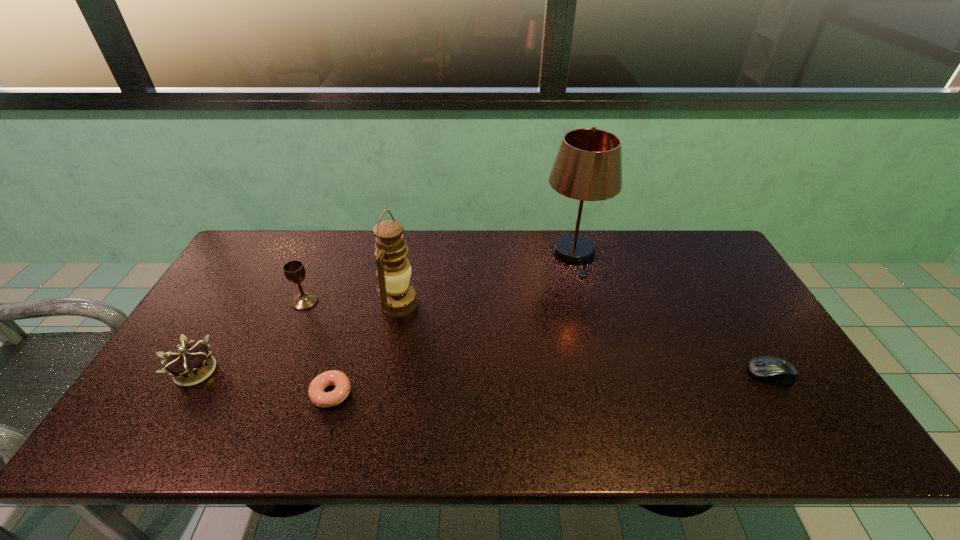
You are a GUI agent. You are given a task and a screenshot of the screen. Output one action in this format:
    pyautogui.click(x=<x>, y=<y>)
    Task: Click on the free point located on the front-facing side of the tallest object
    
    Given the screenshot: What is the action you would take?
    pyautogui.click(x=608, y=384)

Where is `vacant space situated 0.100m on the front of the oil lamp`? Image resolution: width=960 pixels, height=540 pixels. vacant space situated 0.100m on the front of the oil lamp is located at coordinates [x=390, y=351].

At what (x,y) coordinates should I click in order to perform the action: click on blank space located 0.220m on the right of the third tallest object. Please return your answer as a coordinate pair (x, y). The image size is (960, 540). Looking at the image, I should click on (392, 301).

Find the location of `vacant area situated 0.140m on the right of the third shortest object`. vacant area situated 0.140m on the right of the third shortest object is located at coordinates (277, 371).

Where is `free point located 0.390m on the left of the mouse`? free point located 0.390m on the left of the mouse is located at coordinates (594, 375).

This screenshot has height=540, width=960. Identify the location of vacant space located 0.130m on the left of the fourth object from right to left. (257, 393).

In order to click on object that is at the far edge in this screenshot , I will do point(588,167).

I want to click on object at the left edge, so click(x=188, y=366).

This screenshot has width=960, height=540. In order to click on object that is at the right edge in this screenshot , I will do pos(772,370).

The image size is (960, 540). In the image, there is a desktop. Identify the location of blank space at the far edge. (442, 241).